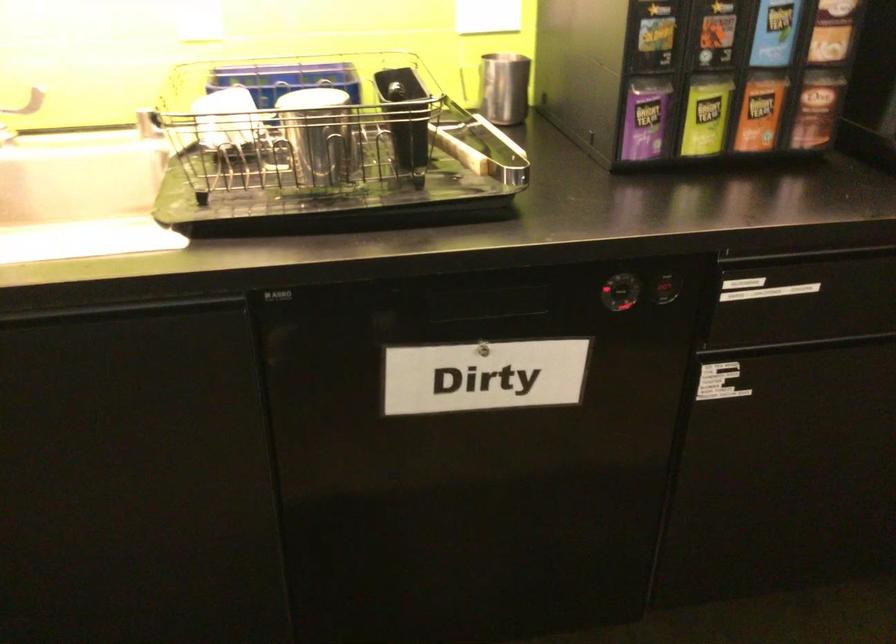
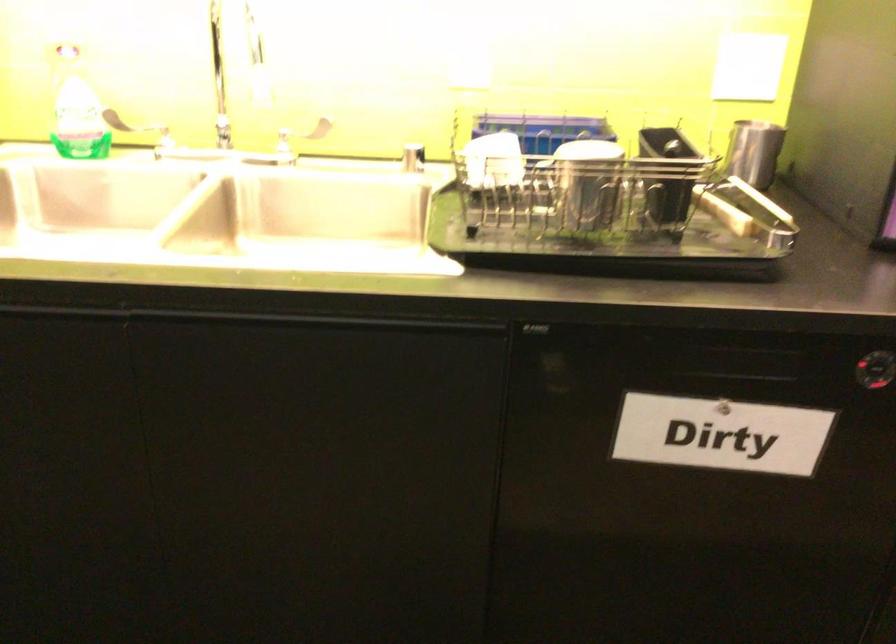
From the picture: Which direction would the cameraman need to move to produce the second image?

The cameraman moved toward left, backward.